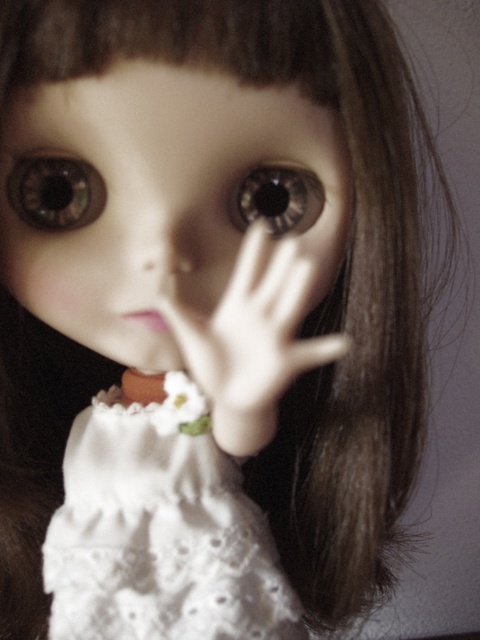
Question: Can you confirm if matte porcelain doll face at center is wider than brown glossy eye at upper left?

Choices:
 (A) yes
 (B) no

Answer: (A)

Question: Which point is farther from the camera taking this photo?

Choices:
 (A) [290, 218]
 (B) [88, 493]
 (C) [143, 244]

Answer: (B)

Question: Which of these objects is positioned farthest from the brown glossy eye at upper left?

Choices:
 (A) white lace hand at center
 (B) matte plastic nose at center
 (C) matte porcelain doll face at center

Answer: (A)

Question: Is matte porcelain doll face at center above white lace dress at center?

Choices:
 (A) yes
 (B) no

Answer: (A)

Question: Can you confirm if brown glossy eye at upper left is thinner than brown glossy eye at center?

Choices:
 (A) yes
 (B) no

Answer: (B)

Question: Which object appears closest to the camera in this image?

Choices:
 (A) white lace dress at center
 (B) white lace hand at center
 (C) matte plastic nose at center

Answer: (B)